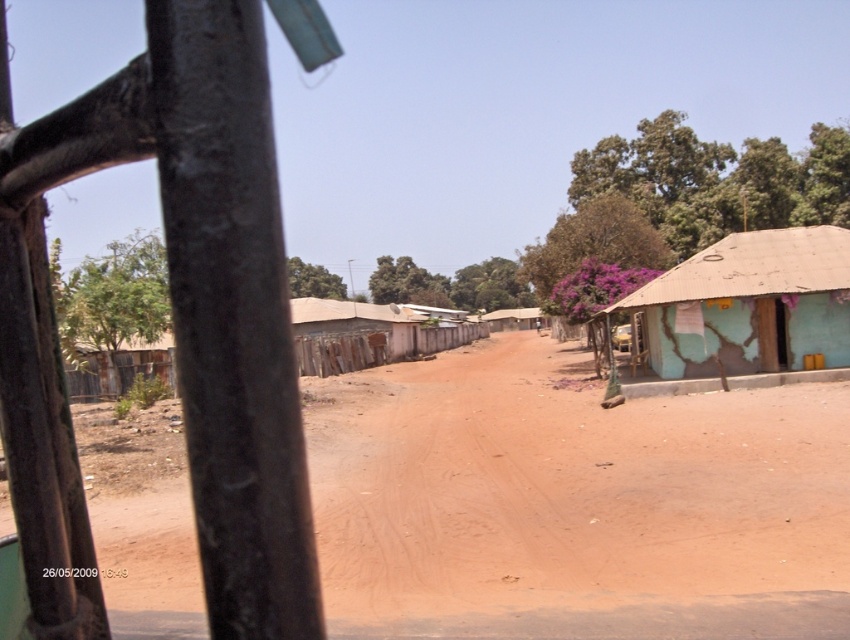
You are a farmer who wants to plant crops in the brown dirt field at center. You have a tractor that is 3 meters wide. Can you drive the tractor through the teal cracked wall hut at right to reach the field?

The brown dirt field at center might be wider than teal cracked wall hut at right, so it is uncertain if the tractor can pass through. Check the width of the entrance first.

You are standing in a rural village and want to cross the dirt road to reach the brown dirt field at center. The road is 3 meters wide. Can you safely cross it without stepping on the road?

The brown dirt field at center is 5.33 meters away from you. Since the road is only 3 meters wide, you can safely cross the road to reach the brown dirt field at center without stepping on the road if you move directly towards it.